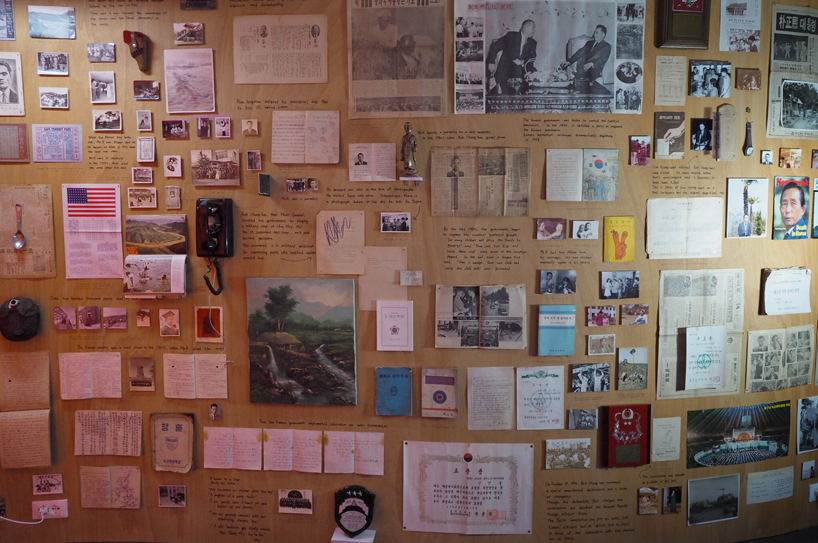
The width and height of the screenshot is (818, 543). I want to click on spoon, so point(18,212).